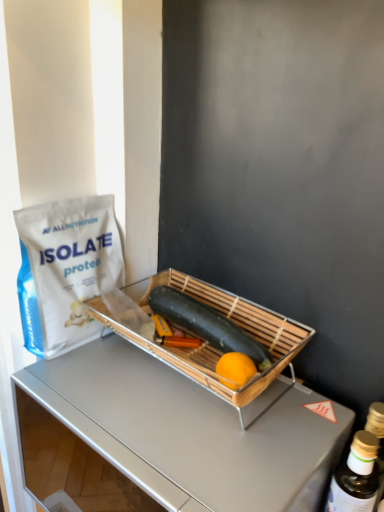
This screenshot has height=512, width=384. I want to click on vacant space in front of smooth green zucchini at center, so click(x=199, y=424).